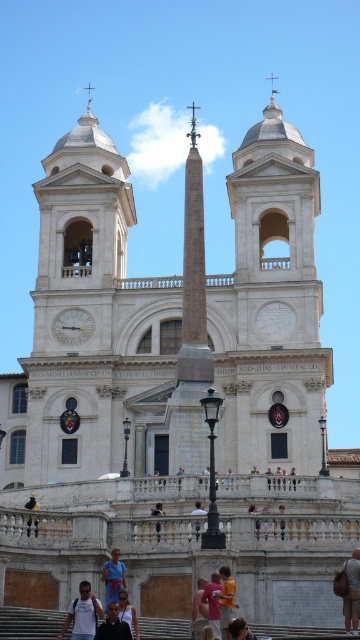
You are standing in front of the grand architectural structure described. You notice a white marble clock at center and a white cotton shirt at lower center. Which object is positioned higher relative to the other?

The white marble clock at center is located above the white cotton shirt at lower center, so it is positioned higher.

You are standing at the base of the central obelisk in the cathedral. You see a pink fabric shirt at lower center and a white fabric at center. How far apart are these two items from each other?

The pink fabric shirt at lower center and white fabric at center are 7.97 meters apart.